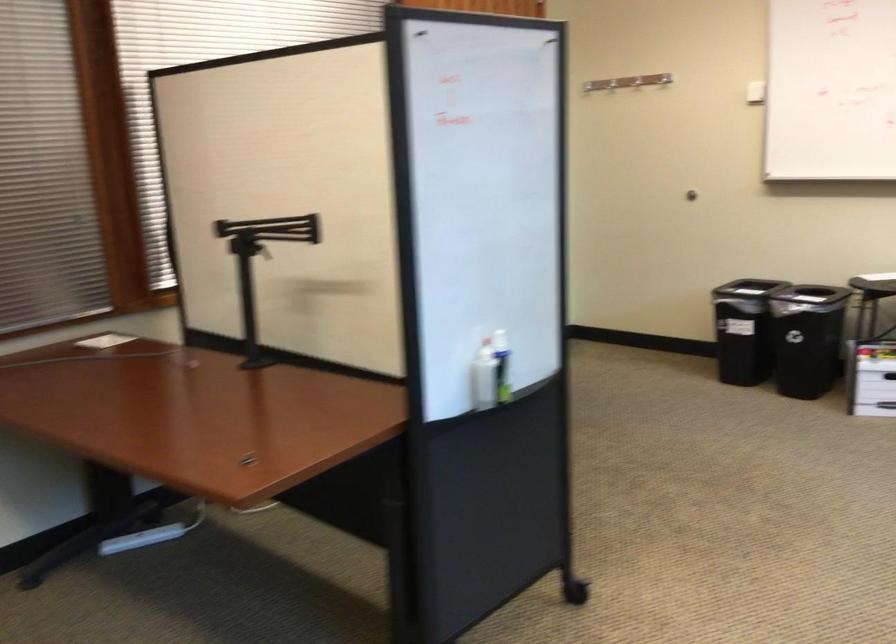
The image size is (896, 644). I want to click on chair sitting surface, so click(874, 287).